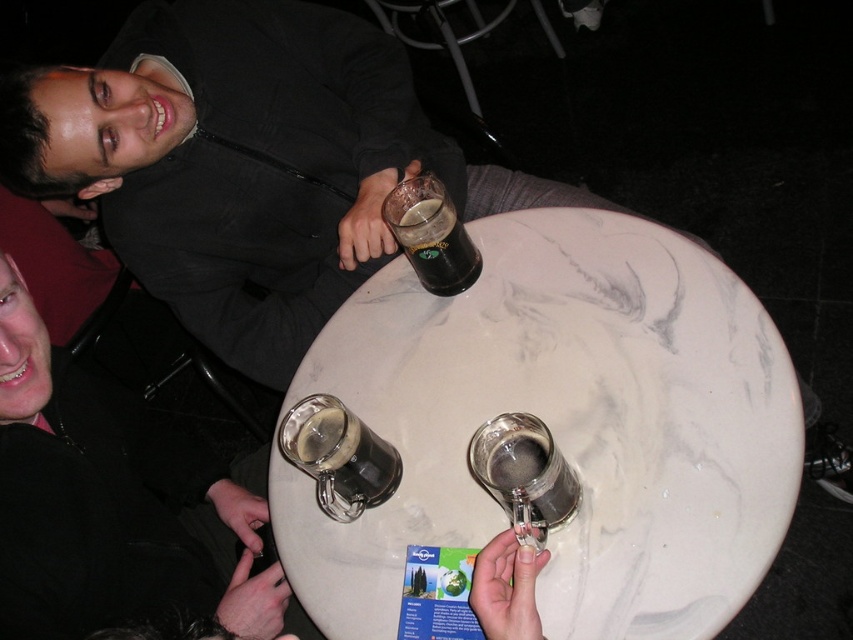
Does white marble table at center have a greater height compared to translucent glass mug at lower center?

Yes.

Between white marble table at center and translucent glass mug at lower center, which one appears on the right side from the viewer's perspective?

From the viewer's perspective, translucent glass mug at lower center appears more on the right side.

Identify the location of white marble table at center. The height and width of the screenshot is (640, 853). (561, 428).

Can you confirm if translucent glass mug at lower center is thinner than dark glass mug at center?

Yes, translucent glass mug at lower center is thinner than dark glass mug at center.

Does translucent glass mug at lower center have a lesser height compared to dark glass mug at center?

Yes.

Does point (479, 435) lie in front of point (410, 240)?

Yes, point (479, 435) is closer to viewer.

Image resolution: width=853 pixels, height=640 pixels. In order to click on translucent glass mug at lower center in this screenshot , I will do `click(524, 474)`.

Is white marble table at center wider than matte black jacket at upper left?

Yes.

Is point (370, 611) in front of point (149, 524)?

Yes, it is in front of point (149, 524).

Where is `white marble table at center`? This screenshot has width=853, height=640. white marble table at center is located at coordinates (561, 428).